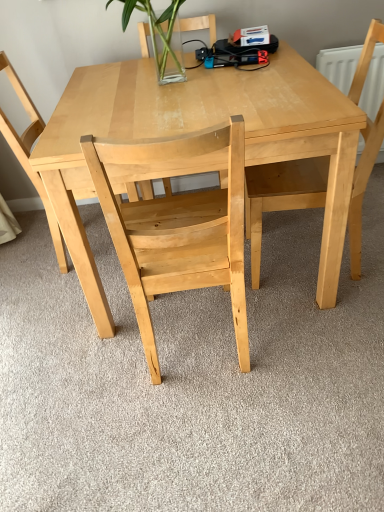
Question: Does natural wood table at center have a lesser width compared to natural wood chair at center, the 2th chair viewed from the left?

Choices:
 (A) yes
 (B) no

Answer: (B)

Question: Is natural wood table at center turned away from natural wood chair at center, the 2th chair viewed from the left?

Choices:
 (A) no
 (B) yes

Answer: (A)

Question: Does natural wood table at center have a smaller size compared to natural wood chair at center, positioned as the 2th chair in right-to-left order?

Choices:
 (A) yes
 (B) no

Answer: (B)

Question: From a real-world perspective, is natural wood table at center on natural wood chair at center, positioned as the 2th chair in right-to-left order?

Choices:
 (A) no
 (B) yes

Answer: (A)

Question: Is natural wood table at center oriented towards natural wood chair at center, the 2th chair viewed from the left?

Choices:
 (A) yes
 (B) no

Answer: (A)

Question: From a real-world perspective, relative to natural wood chair at center, the 2th chair viewed from the left, is natural wood chair at center, the 3th chair viewed from the right, vertically above or below?

Choices:
 (A) above
 (B) below

Answer: (A)

Question: In terms of size, does natural wood chair at center, the 3th chair viewed from the right, appear bigger or smaller than natural wood chair at center, the 2th chair viewed from the left?

Choices:
 (A) small
 (B) big

Answer: (A)

Question: From the image's perspective, is natural wood chair at center, the 3th chair viewed from the right, above or below natural wood chair at center, the 2th chair viewed from the left?

Choices:
 (A) below
 (B) above

Answer: (B)

Question: In terms of width, does natural wood chair at center, which appears as the first chair when viewed from the left, look wider or thinner when compared to natural wood chair at center, positioned as the 2th chair in right-to-left order?

Choices:
 (A) thin
 (B) wide

Answer: (B)

Question: Do you think natural wood chair at center, the 2th chair viewed from the left, is within natural wood table at center, or outside of it?

Choices:
 (A) inside
 (B) outside

Answer: (A)

Question: From the image's perspective, is natural wood chair at center, positioned as the 2th chair in right-to-left order, above or below natural wood table at center?

Choices:
 (A) below
 (B) above

Answer: (A)

Question: Visually, is natural wood chair at center, the 2th chair viewed from the left, positioned to the left or to the right of natural wood table at center?

Choices:
 (A) right
 (B) left

Answer: (B)

Question: Considering their positions, is natural wood chair at center, positioned as the 2th chair in right-to-left order, located in front of or behind natural wood table at center?

Choices:
 (A) front
 (B) behind

Answer: (A)

Question: Visually, is natural wood chair at upper right, placed as the first chair when sorted from right to left, positioned to the left or to the right of natural wood table at center?

Choices:
 (A) left
 (B) right

Answer: (B)

Question: Is natural wood chair at upper right, placed as the 3th chair when sorted from left to right, situated inside natural wood table at center or outside?

Choices:
 (A) inside
 (B) outside

Answer: (A)